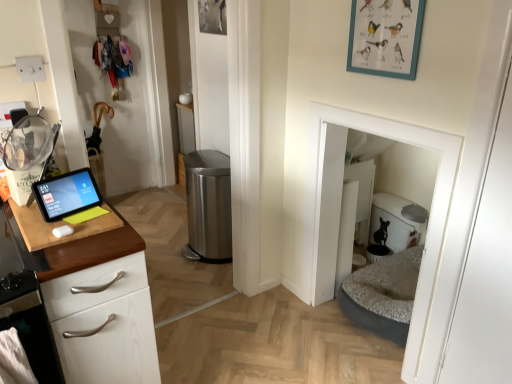
Question: Is wooden cutting board at left far from polished stainless steel trash can at center?

Choices:
 (A) no
 (B) yes

Answer: (B)

Question: Is wooden cutting board at left outside of polished stainless steel trash can at center?

Choices:
 (A) no
 (B) yes

Answer: (B)

Question: Is polished stainless steel trash can at center a part of wooden cutting board at left?

Choices:
 (A) yes
 (B) no

Answer: (B)

Question: Is wooden cutting board at left positioned behind polished stainless steel trash can at center?

Choices:
 (A) no
 (B) yes

Answer: (A)

Question: From a real-world perspective, is wooden cutting board at left physically above polished stainless steel trash can at center?

Choices:
 (A) yes
 (B) no

Answer: (A)

Question: Choose the correct answer: Is black glossy tablet at left inside white matte door at center or outside it?

Choices:
 (A) outside
 (B) inside

Answer: (A)

Question: Considering their positions, is black glossy tablet at left located in front of or behind white matte door at center?

Choices:
 (A) front
 (B) behind

Answer: (B)

Question: In terms of size, does black glossy tablet at left appear bigger or smaller than white matte door at center?

Choices:
 (A) big
 (B) small

Answer: (B)

Question: Is black glossy tablet at left to the left or to the right of white matte door at center in the image?

Choices:
 (A) left
 (B) right

Answer: (A)

Question: From the image's perspective, relative to wooden cutting board at left, is polished stainless steel trash can at center above or below?

Choices:
 (A) above
 (B) below

Answer: (B)

Question: Considering their positions, is polished stainless steel trash can at center located in front of or behind wooden cutting board at left?

Choices:
 (A) front
 (B) behind

Answer: (B)

Question: Which is correct: polished stainless steel trash can at center is inside wooden cutting board at left, or outside of it?

Choices:
 (A) inside
 (B) outside

Answer: (B)

Question: Considering the positions of polished stainless steel trash can at center and wooden cutting board at left in the image, is polished stainless steel trash can at center wider or thinner than wooden cutting board at left?

Choices:
 (A) wide
 (B) thin

Answer: (B)

Question: In the image, is teal matte picture frame at upper center positioned in front of or behind white matte door at center?

Choices:
 (A) front
 (B) behind

Answer: (B)

Question: In terms of height, does teal matte picture frame at upper center look taller or shorter compared to white matte door at center?

Choices:
 (A) short
 (B) tall

Answer: (A)